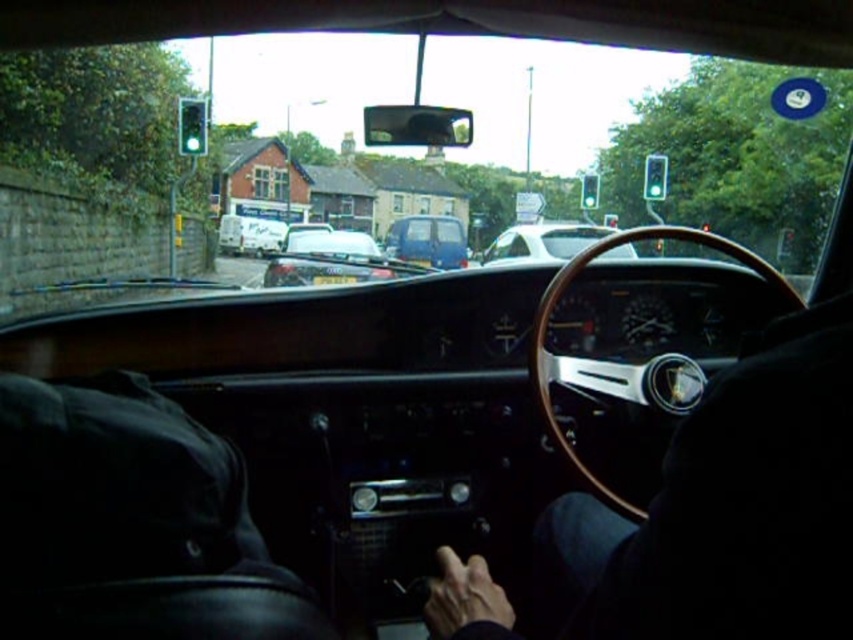
Who is more distant from viewer, (595,195) or (254,253)?

The point (254,253) is more distant.

Does point (590, 195) come farther from viewer compared to point (256, 248)?

No, it is not.

Where is `green glass traffic light at center`? green glass traffic light at center is located at coordinates (589, 192).

Is wooden/leather steering wheel at center wider than green glass traffic light at upper right?

Correct, the width of wooden/leather steering wheel at center exceeds that of green glass traffic light at upper right.

Which is in front, point (602, 484) or point (653, 182)?

Point (602, 484) is in front.

This screenshot has height=640, width=853. Find the location of `wooden/leather steering wheel at center`. wooden/leather steering wheel at center is located at coordinates (613, 362).

Is the position of green glass traffic light at upper right more distant than that of wooden steering wheel at center?

No.

Is point (665, 164) behind point (257, 253)?

No, (665, 164) is closer to viewer.

Locate an element on the screen. Image resolution: width=853 pixels, height=640 pixels. green glass traffic light at upper right is located at coordinates (654, 177).